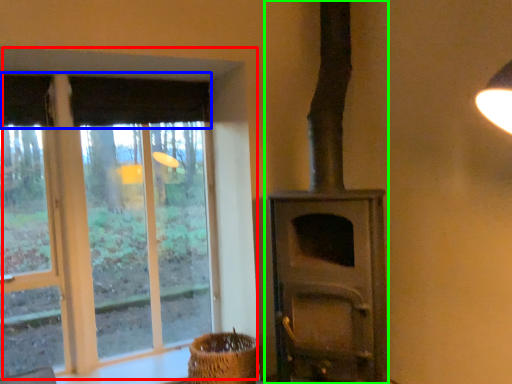
Question: Which object is positioned closest to window (highlighted by a red box)? Select from curtain (highlighted by a blue box) and wood burning stove (highlighted by a green box).

Choices:
 (A) curtain
 (B) wood burning stove

Answer: (A)